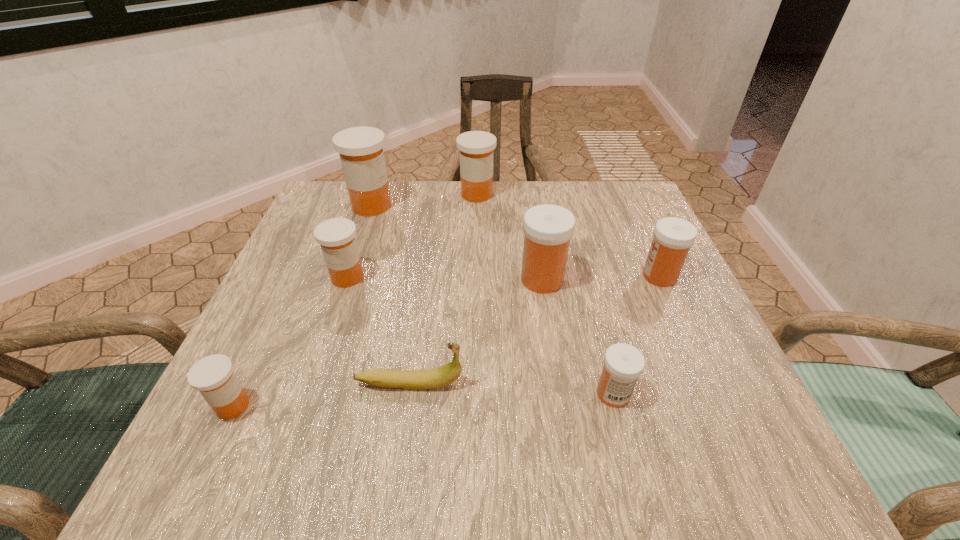
The image size is (960, 540). In order to click on the smallest orange medicine in this screenshot , I will do `click(213, 376)`.

In order to click on the leftmost medicine in this screenshot , I will do `click(213, 376)`.

At what (x,y) coordinates should I click in order to perform the action: click on the second white medicine from left to right. Please return your answer as a coordinate pair (x, y). Image resolution: width=960 pixels, height=540 pixels. Looking at the image, I should click on (623, 363).

Where is `the second medicine from right to left`? This screenshot has width=960, height=540. the second medicine from right to left is located at coordinates (623, 363).

Locate an element on the screen. This screenshot has height=540, width=960. vacant space located 0.150m on the label of the tallest object is located at coordinates (455, 206).

Locate an element on the screen. vacant space situated on the label of the rightmost orange medicine is located at coordinates (522, 194).

You are a GUI agent. You are given a task and a screenshot of the screen. Output one action in this format:
    pyautogui.click(x=<x>, y=<y>)
    Task: Click on the vacant area located on the back of the fifth medicine from left to right
    The height and width of the screenshot is (540, 960).
    Given the screenshot: What is the action you would take?
    pyautogui.click(x=527, y=183)

I want to click on vacant point located on the label of the second smallest orange medicine, so click(327, 337).

Find the location of a particular element. This screenshot has width=960, height=540. free space located 0.170m on the left of the rightmost object is located at coordinates (559, 276).

Find the location of a particular element. This screenshot has height=540, width=960. free space located 0.400m at the stem of the banana is located at coordinates (711, 383).